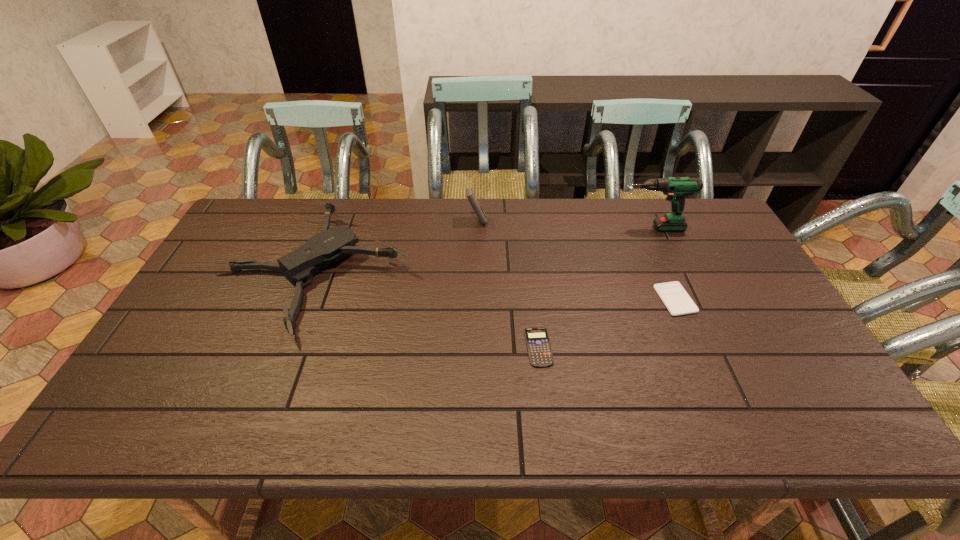
This screenshot has width=960, height=540. I want to click on object that is at the right edge, so click(676, 188).

Locate an element on the screen. The width and height of the screenshot is (960, 540). object that is at the far left corner is located at coordinates (320, 251).

Find the location of a particular element. Image resolution: width=960 pixels, height=540 pixels. object that is at the far right corner is located at coordinates (676, 188).

I want to click on vacant space at the far edge, so click(410, 208).

The width and height of the screenshot is (960, 540). I want to click on vacant space at the near edge of the desktop, so click(x=447, y=428).

Identify the location of vacant region at the left edge. (248, 271).

This screenshot has width=960, height=540. In order to click on free space at the right edge of the desktop in this screenshot , I will do `click(752, 368)`.

Locate an element on the screen. The image size is (960, 540). vacant space at the far left corner of the desktop is located at coordinates (278, 199).

In order to click on vacant space that's between the third object from right to left and the fourth object from right to left in this screenshot , I will do `click(508, 284)`.

Locate an element on the screen. The image size is (960, 540). vacant area that lies between the leftmost object and the second tallest calculator is located at coordinates coord(494,286).